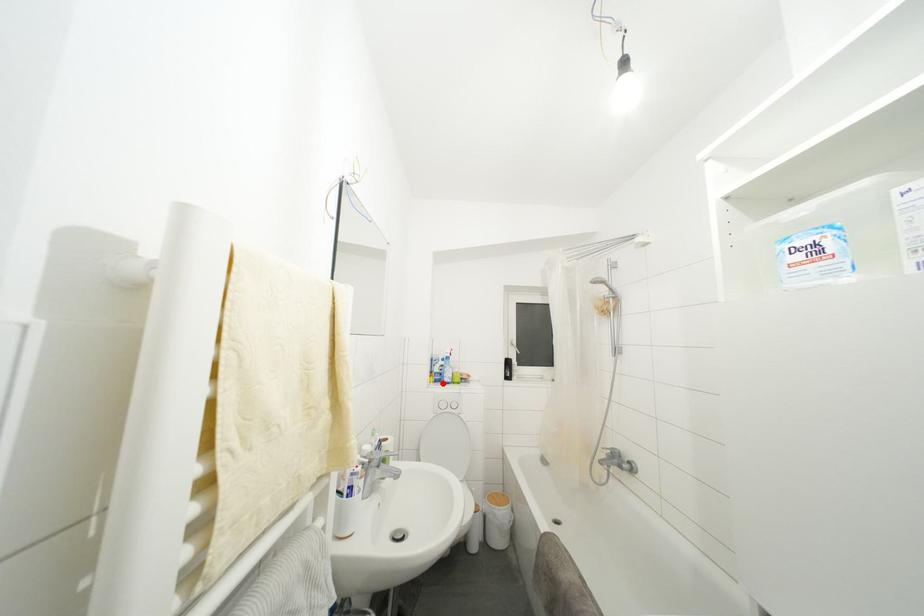
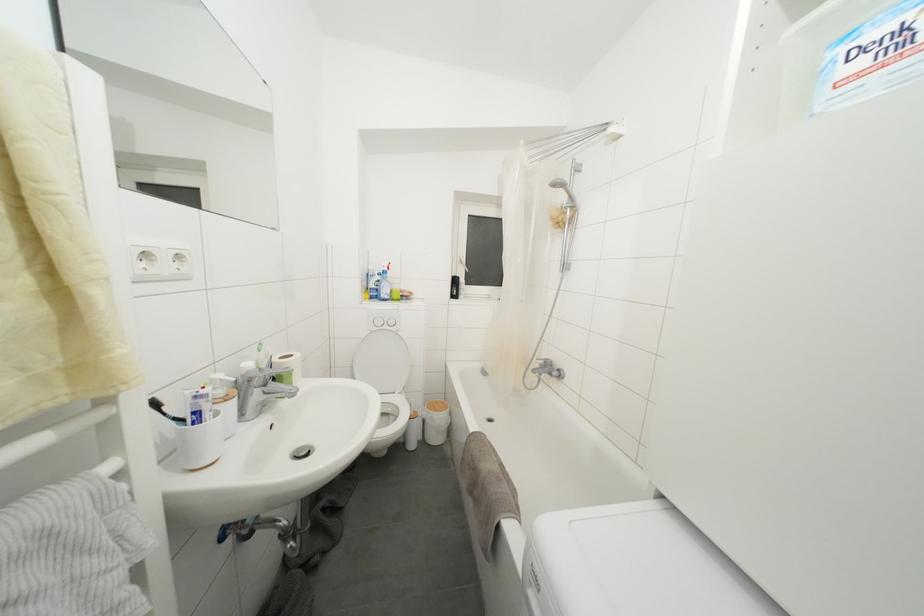
Question: A red point is marked in image1. In image2, is the corresponding 3D point closer to the camera or farther? Reply with the corresponding letter.

Choices:
 (A) The corresponding 3D point is closer.
 (B) The corresponding 3D point is farther.

Answer: (A)